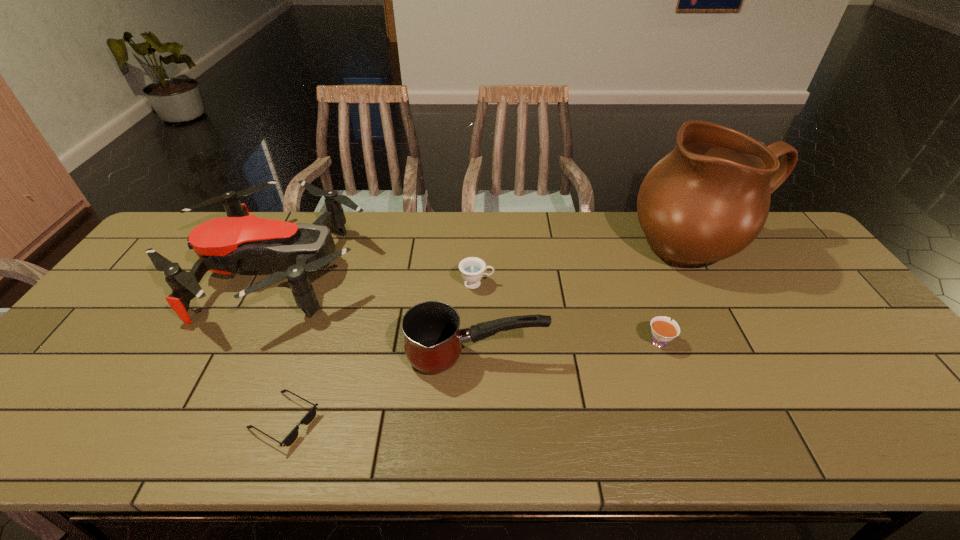
Identify the location of vacant space located 0.250m on the handle side of the saucepan. (646, 357).

Locate an element on the screen. This screenshot has height=540, width=960. vacant space situated on the side of the farther teacup with the handle is located at coordinates (528, 284).

Identify the location of vacant space located 0.250m on the side of the right teacup with the handle. The height and width of the screenshot is (540, 960). (630, 266).

Where is `free point located on the side of the right teacup with the handle`? The width and height of the screenshot is (960, 540). free point located on the side of the right teacup with the handle is located at coordinates (628, 259).

Locate an element on the screen. This screenshot has height=540, width=960. vacant space located 0.150m on the side of the right teacup with the handle is located at coordinates (638, 289).

The image size is (960, 540). What are the coordinates of `vacant area situated on the lenses of the sunglasses` in the screenshot? It's located at (382, 421).

Where is `cream pitcher that is positioned at the far edge`? This screenshot has width=960, height=540. cream pitcher that is positioned at the far edge is located at coordinates (708, 199).

Where is `drone that is positioned at the far edge`? drone that is positioned at the far edge is located at coordinates (223, 245).

Find the location of a particular element. The height and width of the screenshot is (540, 960). object present at the near edge is located at coordinates (310, 416).

Image resolution: width=960 pixels, height=540 pixels. I want to click on object that is positioned at the left edge, so click(223, 245).